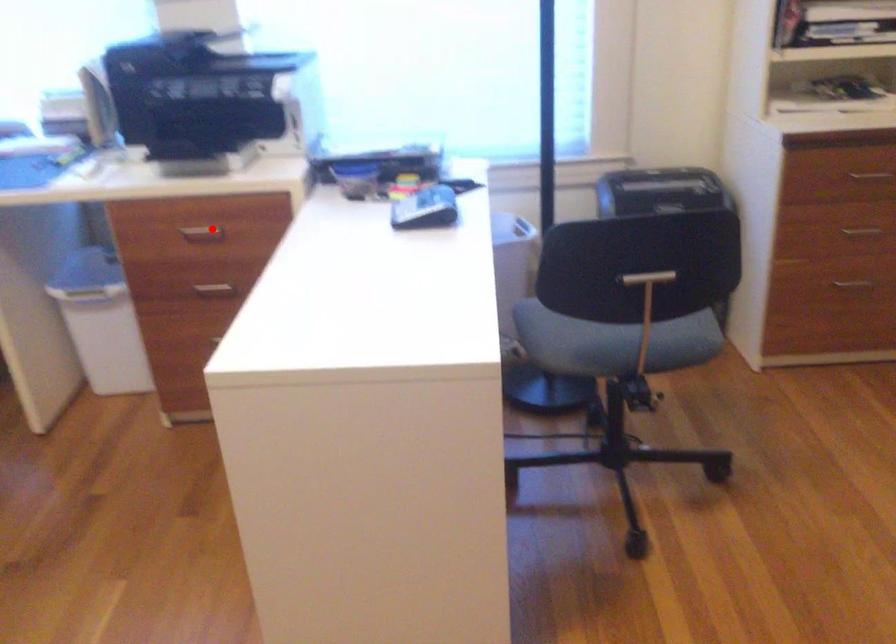
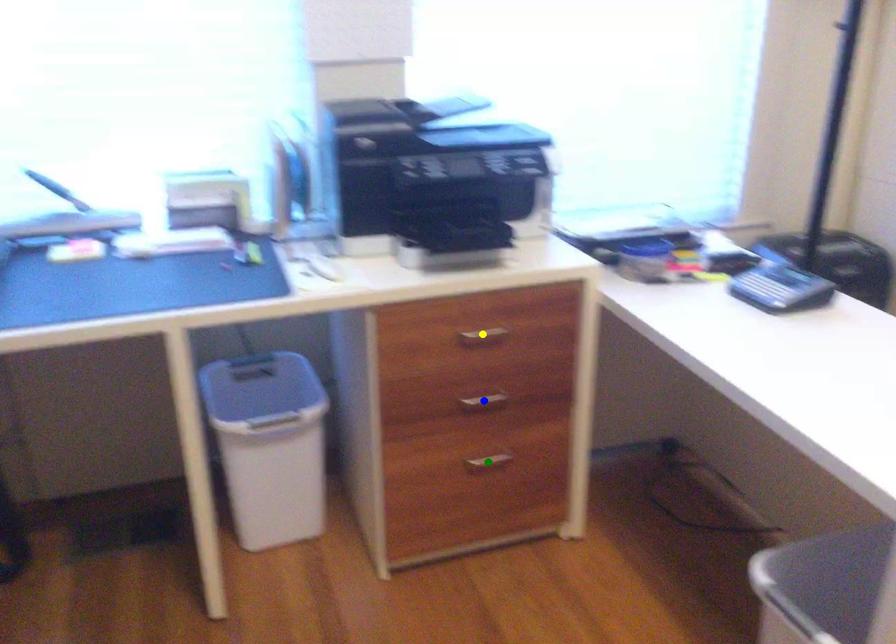
Question: I am providing you with two images of the same scene from different viewpoints. A red point is marked on the first image. You are given multiple points on the second image. Which spot in image 2 lines up with the point in image 1?

Choices:
 (A) green point
 (B) yellow point
 (C) blue point

Answer: (B)